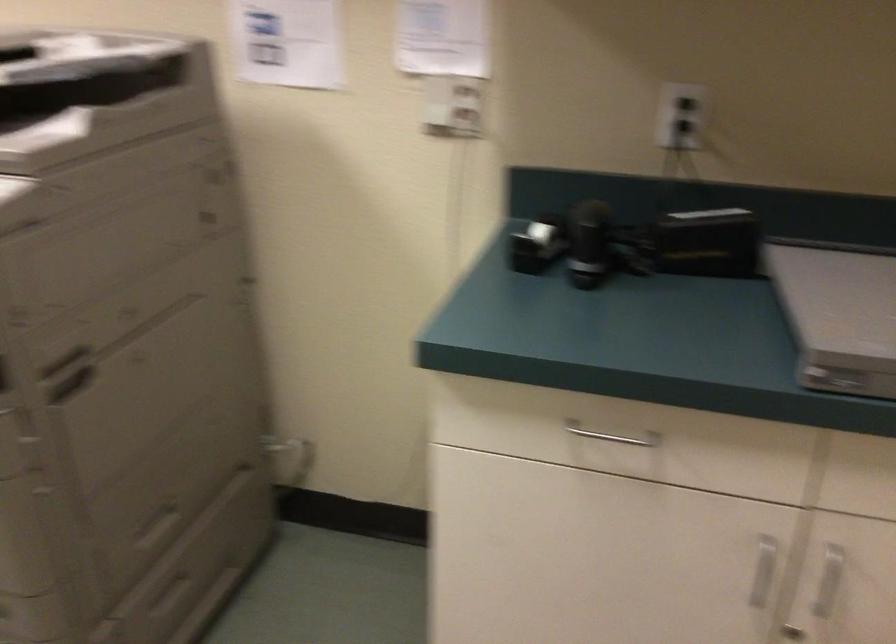
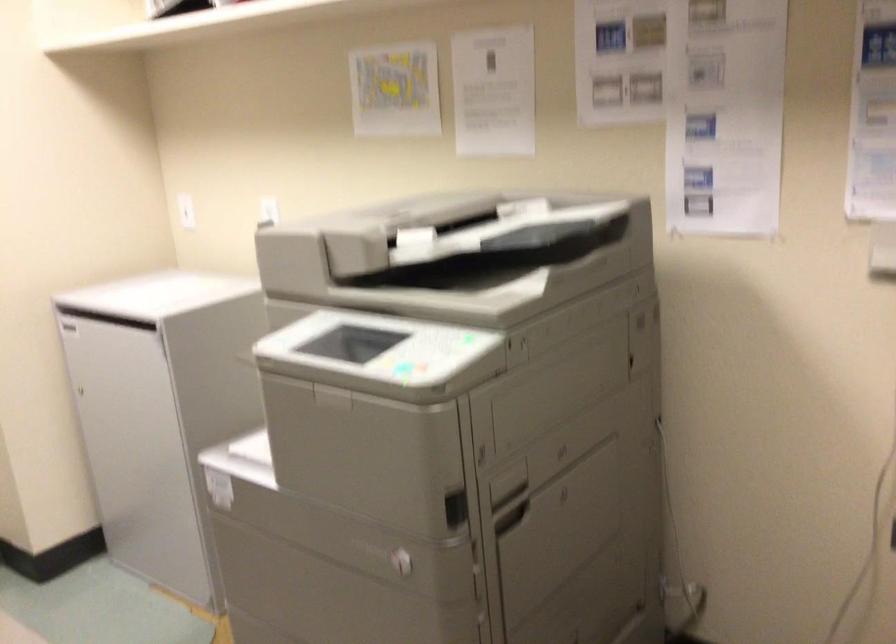
Question: Which direction would the cameraman need to move to produce the second image? Reply with the corresponding letter.

Choices:
 (A) Left
 (B) Right
 (C) Forward
 (D) Backward

Answer: (A)